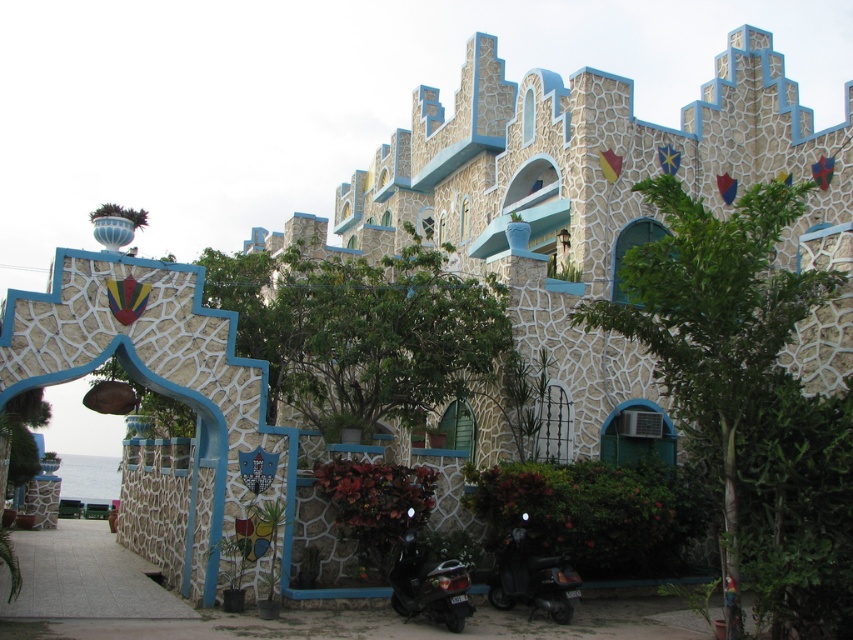
Where is `black glossy scooter at lower right`? This screenshot has height=640, width=853. black glossy scooter at lower right is located at coordinates (532, 579).

Does black glossy scooter at lower right appear on the left side of shiny black scooter at lower center?

In fact, black glossy scooter at lower right is to the right of shiny black scooter at lower center.

Which is behind, point (515, 534) or point (405, 564)?

Point (515, 534)

Where is `black glossy scooter at lower right`? The image size is (853, 640). black glossy scooter at lower right is located at coordinates (532, 579).